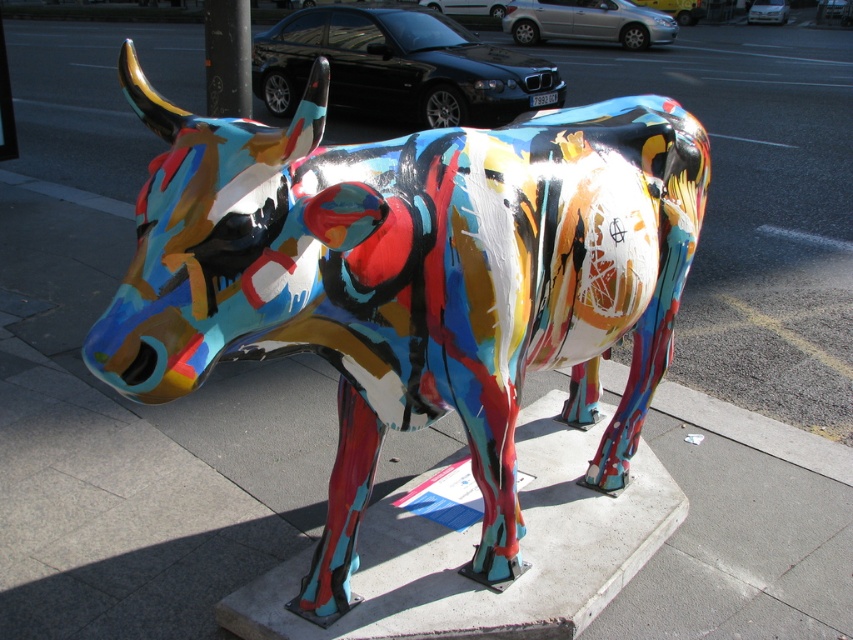
Does metallic multicolored cow at center have a lesser width compared to black glossy pole at upper center?

Incorrect, metallic multicolored cow at center's width is not less than black glossy pole at upper center's.

Does metallic multicolored cow at center have a lesser height compared to black glossy pole at upper center?

No, metallic multicolored cow at center is not shorter than black glossy pole at upper center.

The width and height of the screenshot is (853, 640). Identify the location of metallic multicolored cow at center. (412, 282).

Does metallic concrete at lower center lie behind black glossy pole at upper center?

That is False.

Which is behind, point (554, 404) or point (238, 74)?

Point (238, 74)

Is point (595, 522) less distant than point (248, 99)?

Yes, point (595, 522) is in front of point (248, 99).

Locate an element on the screen. metallic concrete at lower center is located at coordinates (474, 547).

Which of these two, metallic multicolored cow at center or metallic concrete at lower center, stands taller?

metallic multicolored cow at center

Can you confirm if metallic multicolored cow at center is thinner than metallic concrete at lower center?

In fact, metallic multicolored cow at center might be wider than metallic concrete at lower center.

This screenshot has height=640, width=853. Describe the element at coordinates (412, 282) in the screenshot. I see `metallic multicolored cow at center` at that location.

Locate an element on the screen. Image resolution: width=853 pixels, height=640 pixels. metallic multicolored cow at center is located at coordinates (412, 282).